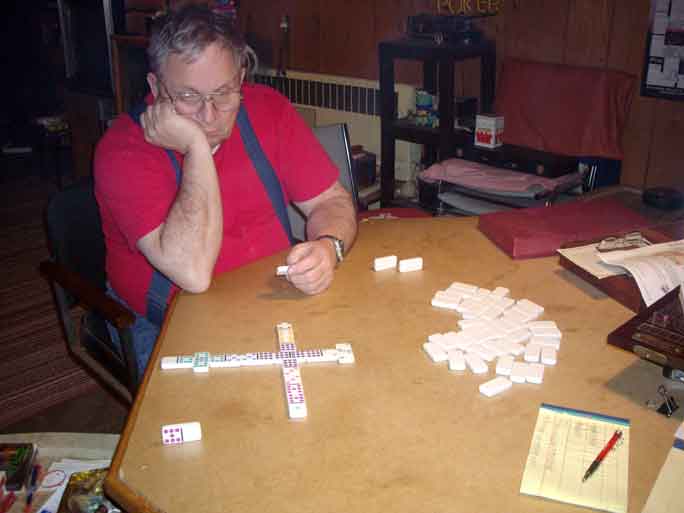
Locate an element on the screen. The width and height of the screenshot is (684, 513). flooring is located at coordinates (81, 408).